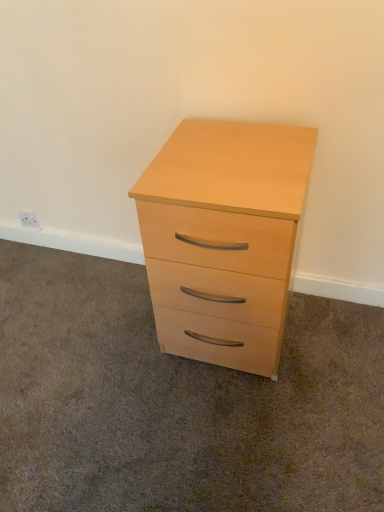
Locate an element on the screen. This screenshot has width=384, height=512. vacant region above light wood chest of drawers at center (from a real-world perspective) is located at coordinates (231, 152).